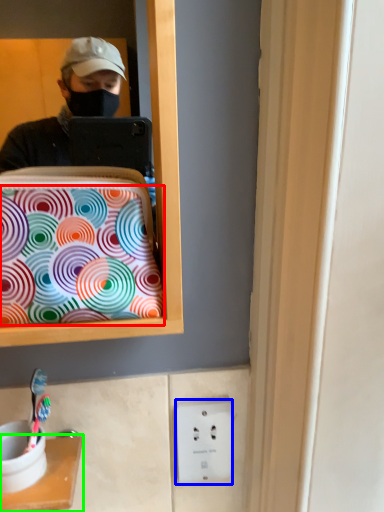
Question: Considering the real-world distances, which object is farthest from pattern (highlighted by a red box)? electric outlet (highlighted by a blue box) or furniture (highlighted by a green box)?

Choices:
 (A) electric outlet
 (B) furniture

Answer: (A)